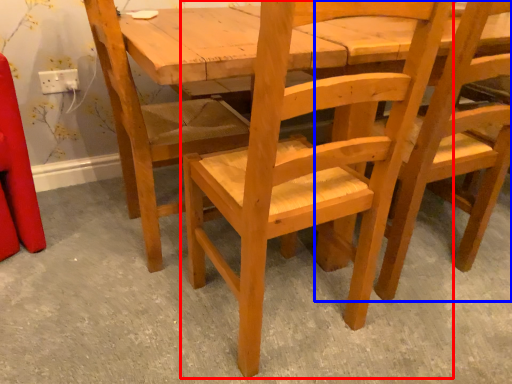
Question: Which object is closer to the camera taking this photo, chair (highlighted by a red box) or chair (highlighted by a blue box)?

Choices:
 (A) chair
 (B) chair

Answer: (A)